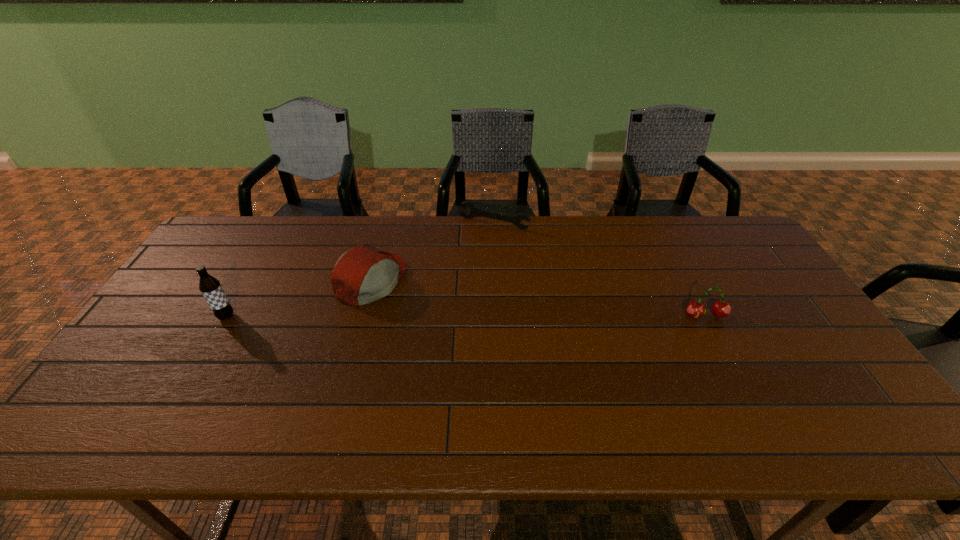
This screenshot has height=540, width=960. I want to click on free spot between the second farthest object and the cherry, so click(539, 298).

This screenshot has height=540, width=960. I want to click on empty space that is in between the leftmost object and the second object from left to right, so click(x=299, y=299).

Locate which object is the third closest to the cherry. Please provide its 2D coordinates. Your answer should be formatted as a tuple, i.e. [(x, y)], where the tuple contains the x and y coordinates of a point satisfying the conditions above.

[(210, 287)]

Identify the location of object that is the third closest one to the second object from right to left. (210, 287).

Where is `vacant region that satisfies the following two spatial constraints: 1. on the back side of the tallest object; 2. on the right side of the shortest object`? vacant region that satisfies the following two spatial constraints: 1. on the back side of the tallest object; 2. on the right side of the shortest object is located at coordinates (280, 223).

This screenshot has height=540, width=960. Identify the location of vacant space that satisfies the following two spatial constraints: 1. on the back side of the cap; 2. on the right side of the root beer. (248, 280).